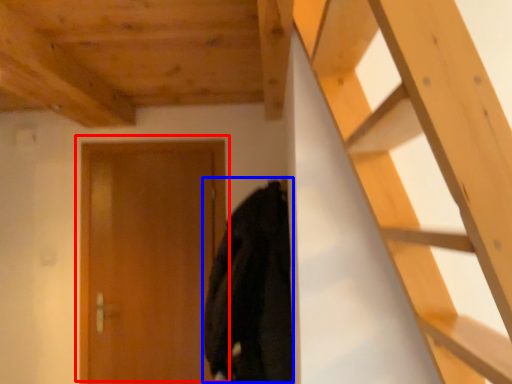
Question: Which object appears farthest to the camera in this image, door (highlighted by a red box) or cloak (highlighted by a blue box)?

Choices:
 (A) door
 (B) cloak

Answer: (A)